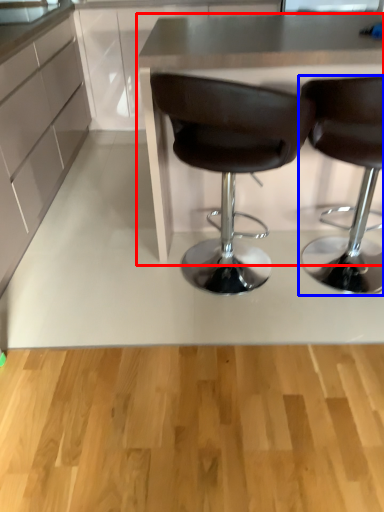
Question: Which object appears farthest to the camera in this image, table (highlighted by a red box) or chair (highlighted by a blue box)?

Choices:
 (A) table
 (B) chair

Answer: (A)